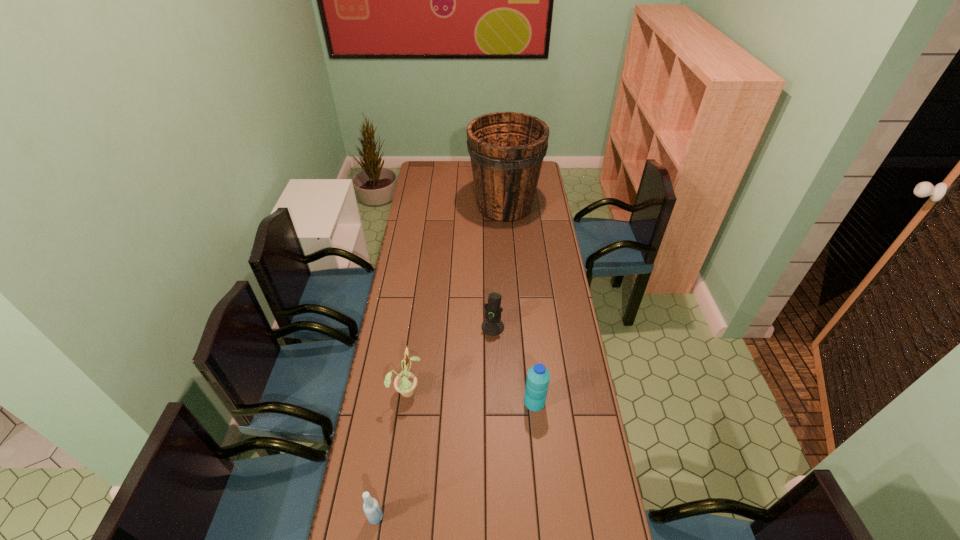
The height and width of the screenshot is (540, 960). Identify the location of empty space that is in between the microphone and the sunflower. (449, 359).

Locate an element on the screen. free point between the microphone and the nearest object is located at coordinates pos(434,422).

Where is `unoccupied position between the water bottle and the sunflower`? This screenshot has height=540, width=960. unoccupied position between the water bottle and the sunflower is located at coordinates (470, 396).

Where is `free point between the sunflower and the bottle`? free point between the sunflower and the bottle is located at coordinates (391, 454).

Image resolution: width=960 pixels, height=540 pixels. Identify the location of empty space that is in between the sunflower and the farthest object. (456, 298).

This screenshot has height=540, width=960. I want to click on free space between the bucket and the water bottle, so click(x=519, y=304).

Image resolution: width=960 pixels, height=540 pixels. Find the location of `free space that is in between the sunflower and the microphone`. free space that is in between the sunflower and the microphone is located at coordinates (449, 359).

You are a GUI agent. You are given a task and a screenshot of the screen. Output one action in this format:
    pyautogui.click(x=<x>, y=<y>)
    Task: Click on the unoccupied area between the microphone and the water bottle
    This screenshot has width=960, height=540.
    Given the screenshot: What is the action you would take?
    [x=514, y=364]

Locate an element on the screen. The width and height of the screenshot is (960, 540). blank region between the water bottle and the bucket is located at coordinates (519, 304).

In order to click on object that is the third closest to the farthest object in this screenshot , I will do `click(538, 377)`.